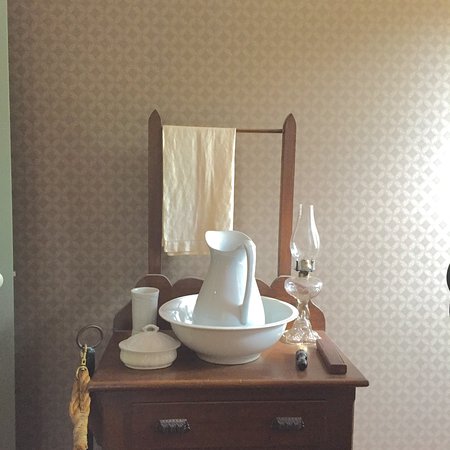
You are a GUI agent. You are given a task and a screenshot of the screen. Output one action in this format:
    pyautogui.click(x=<x>, y=<y>)
    Task: Click on the beige towel
    This screenshot has height=450, width=450.
    Given the screenshot: What is the action you would take?
    pyautogui.click(x=182, y=163)